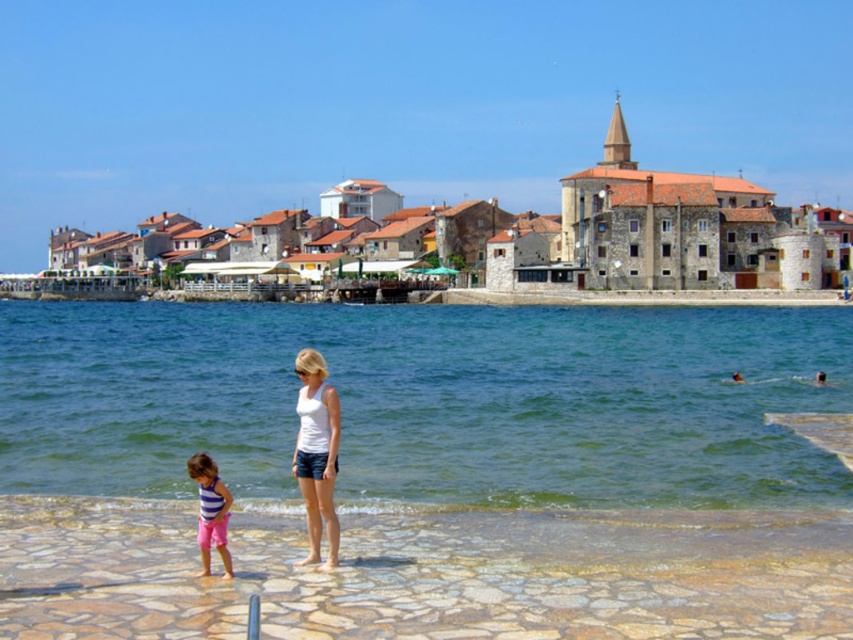
Question: Which object appears closest to the camera in this image?

Choices:
 (A) brown stone buildings at center
 (B) smooth stone beach at center
 (C) white matte tank top at center

Answer: (B)

Question: Does clear blue water at lower center appear on the right side of smooth stone beach at center?

Choices:
 (A) no
 (B) yes

Answer: (B)

Question: Considering the real-world distances, which object is closest to the pink denim shorts at lower left?

Choices:
 (A) white matte tank top at center
 (B) smooth stone beach at center

Answer: (A)

Question: Is the position of brown stone buildings at center less distant than that of white matte tank top at center?

Choices:
 (A) no
 (B) yes

Answer: (A)

Question: Is brown stone buildings at center to the left of white matte tank top at center from the viewer's perspective?

Choices:
 (A) no
 (B) yes

Answer: (A)

Question: Which of the following is the farthest from the observer?

Choices:
 (A) (312, 336)
 (B) (730, 616)

Answer: (A)